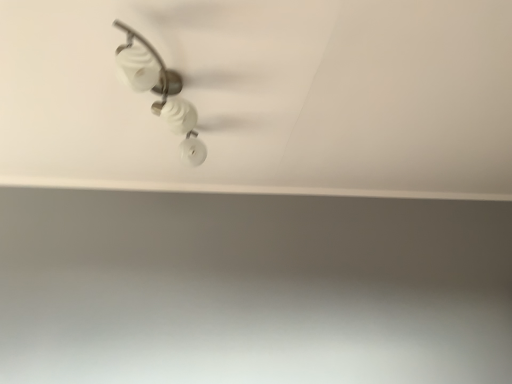
Measure the distance between point (174, 74) and camera.

4.13 feet.

Describe the element at coordinates (161, 91) in the screenshot. Image resolution: width=512 pixels, height=384 pixels. I see `white glossy light fixture at upper center` at that location.

This screenshot has width=512, height=384. In order to click on white glossy light fixture at upper center in this screenshot , I will do `click(161, 91)`.

Find the location of `white glossy light fixture at upper center`. white glossy light fixture at upper center is located at coordinates (161, 91).